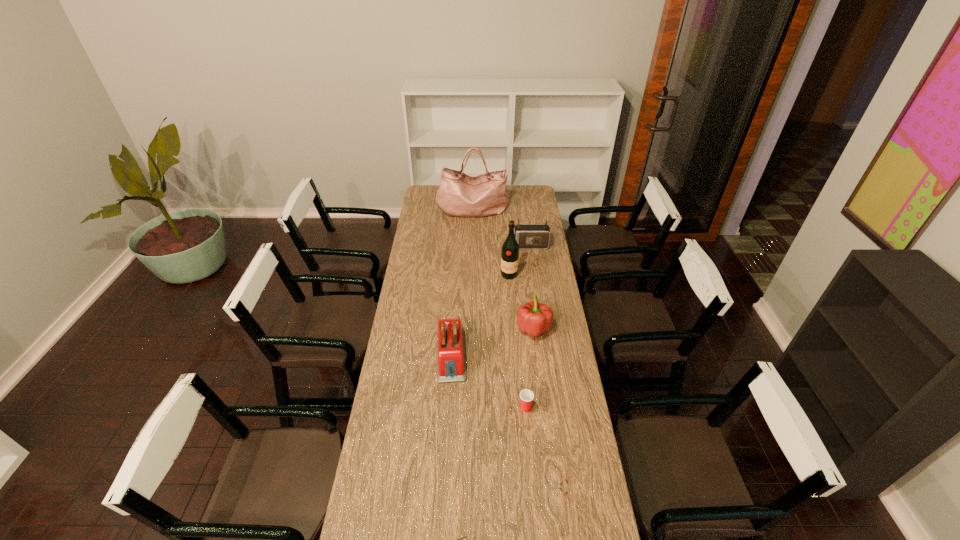
Where is `vacant space that satisfies the following two spatial constraints: 1. at the front of the farthest object with handles; 2. on the left side of the bell pepper`? vacant space that satisfies the following two spatial constraints: 1. at the front of the farthest object with handles; 2. on the left side of the bell pepper is located at coordinates (470, 329).

The width and height of the screenshot is (960, 540). Identify the location of vacant region that satisfies the following two spatial constraints: 1. on the front-facing side of the second tallest object; 2. on the left side of the bell pepper. (513, 329).

Find the location of `vacant region that satisfies the following two spatial constraints: 1. at the lens of the camcorder; 2. on the left side of the shears`. vacant region that satisfies the following two spatial constraints: 1. at the lens of the camcorder; 2. on the left side of the shears is located at coordinates coord(561,489).

What are the coordinates of `vacant region that satisfies the following two spatial constraints: 1. on the front-facing side of the second tallest object; 2. on the right side of the bell pepper` in the screenshot? It's located at (513, 329).

Locate an element on the screen. blank space that satisfies the following two spatial constraints: 1. at the front of the handbag with handles; 2. on the right side of the Dixie cup is located at coordinates (468, 408).